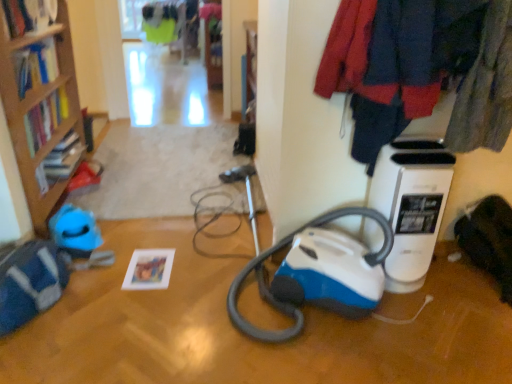
The image size is (512, 384). What are the coordinates of `free spot above matte paper photo frame at lower left, which is counted as the first book, starting from the bottom (from a real-world perspective)` in the screenshot? It's located at (151, 265).